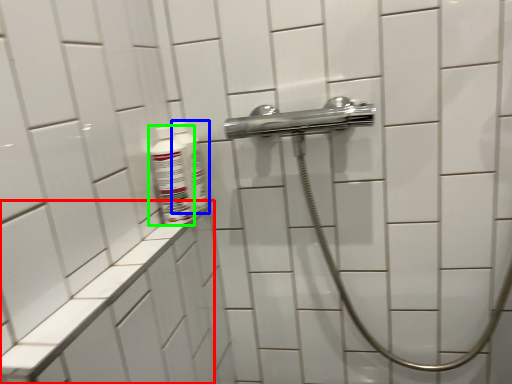
Question: Considering the real-world distances, which object is closest to ledge (highlighted by a red box)? mouthwash (highlighted by a blue box) or mouthwash (highlighted by a green box).

Choices:
 (A) mouthwash
 (B) mouthwash

Answer: (B)